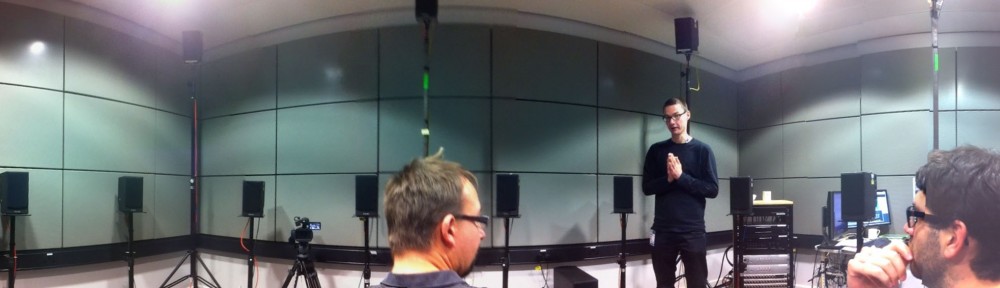
Find the location of a particular element. Image resolution: width=1000 pixels, height=288 pixels. computers is located at coordinates (882, 215), (836, 225).